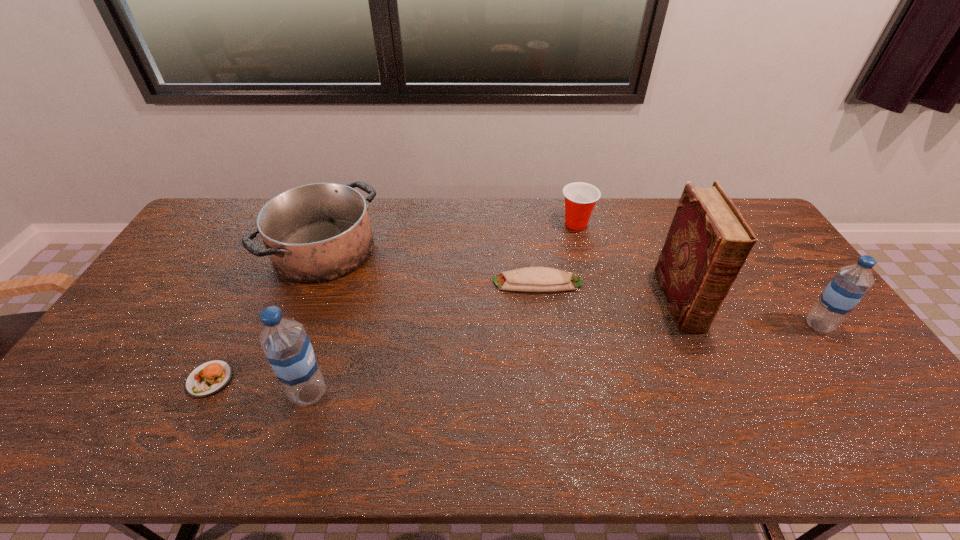
To achieve even spacing by inserting another water_bottle among them, please point to a vacant spot for this new water_bottle. Please provide its 2D coordinates. Your answer should be formatted as a tuple, i.e. [(x, y)], where the tuple contains the x and y coordinates of a point satisfying the conditions above.

[(581, 356)]